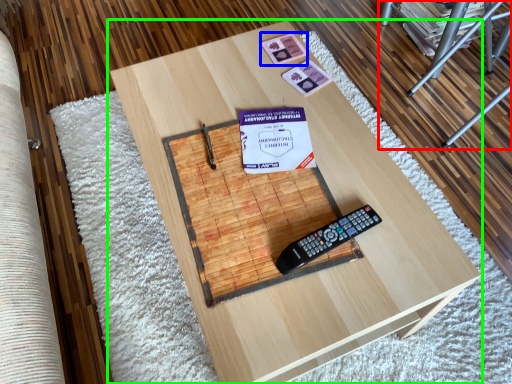
Question: Considering the real-world distances, which object is closest to furniture (highlighted by a red box)? square (highlighted by a blue box) or table (highlighted by a green box).

Choices:
 (A) square
 (B) table

Answer: (A)